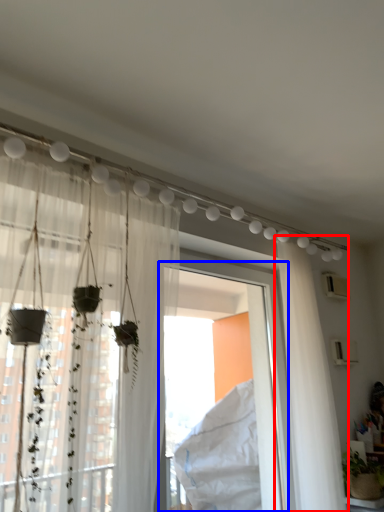
Question: Which point is closer to the camera, curtain (highlighted by a red box) or window frame (highlighted by a blue box)?

Choices:
 (A) curtain
 (B) window frame

Answer: (B)